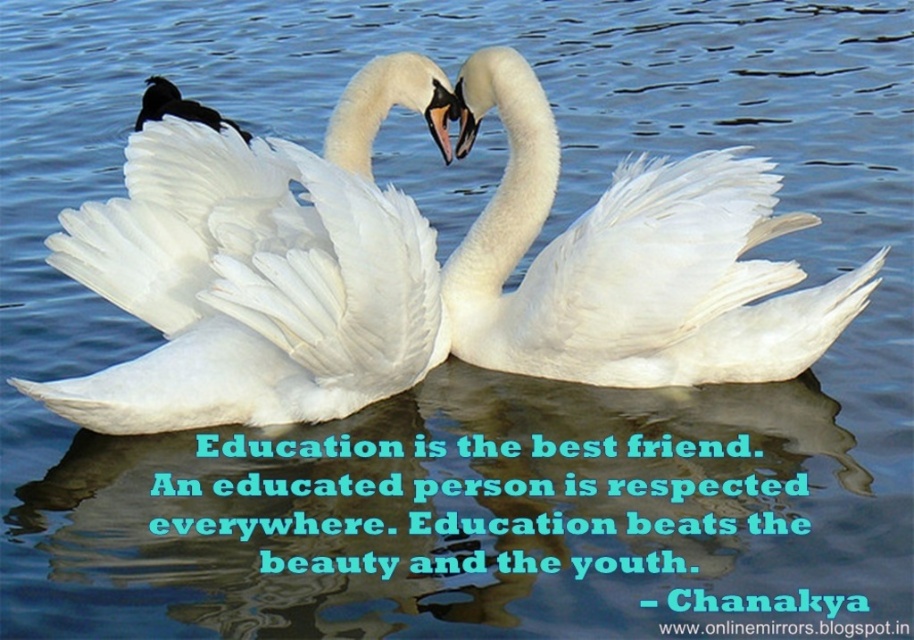
Does point (126, 369) lie behind point (190, 100)?

No.

Consider the image. Who is shorter, white glossy swan at upper left or black feathered duck at upper left?

Standing shorter between the two is black feathered duck at upper left.

Locate an element on the screen. Image resolution: width=914 pixels, height=640 pixels. white glossy swan at upper left is located at coordinates (197, 284).

You are a GUI agent. You are given a task and a screenshot of the screen. Output one action in this format:
    pyautogui.click(x=<x>, y=<y>)
    Task: Click on the white glossy swan at upper left
    The height and width of the screenshot is (640, 914).
    Given the screenshot: What is the action you would take?
    pyautogui.click(x=197, y=284)

Is white feathered swan at center further to camera compared to black feathered duck at upper left?

That is False.

Does point (572, 344) come behind point (163, 92)?

That is False.

Does point (618, 234) come in front of point (169, 83)?

Yes, it is in front of point (169, 83).

Locate an element on the screen. white feathered swan at center is located at coordinates point(631,260).

Is white feathered swan at center wider than white glossy swan at upper left?

Indeed, white feathered swan at center has a greater width compared to white glossy swan at upper left.

Between white feathered swan at center and white glossy swan at upper left, which one is positioned lower?

white glossy swan at upper left is below.

Who is more distant from viewer, [742,349] or [161,323]?

The point [742,349] is more distant.

Image resolution: width=914 pixels, height=640 pixels. In order to click on white feathered swan at center in this screenshot , I will do pyautogui.click(x=631, y=260).